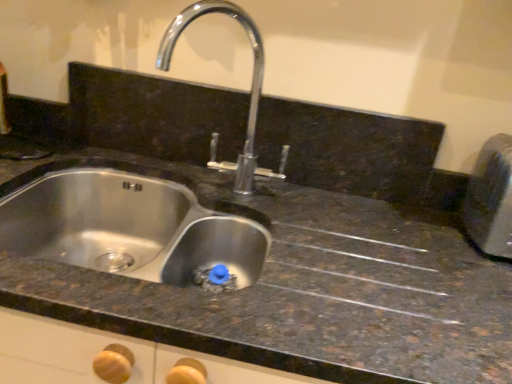
Question: Considering the relative sizes of metallic silver toaster at right and polished chrome tap at center in the image provided, is metallic silver toaster at right taller than polished chrome tap at center?

Choices:
 (A) yes
 (B) no

Answer: (B)

Question: Considering the relative sizes of metallic silver toaster at right and polished chrome tap at center in the image provided, is metallic silver toaster at right thinner than polished chrome tap at center?

Choices:
 (A) no
 (B) yes

Answer: (A)

Question: Does metallic silver toaster at right have a greater width compared to polished chrome tap at center?

Choices:
 (A) yes
 (B) no

Answer: (A)

Question: Is metallic silver toaster at right far from polished chrome tap at center?

Choices:
 (A) yes
 (B) no

Answer: (B)

Question: Is polished chrome tap at center at the back of metallic silver toaster at right?

Choices:
 (A) yes
 (B) no

Answer: (B)

Question: Is the position of metallic silver toaster at right more distant than that of polished chrome tap at center?

Choices:
 (A) yes
 (B) no

Answer: (A)

Question: Is polished chrome tap at center a part of stainless steel sink at center?

Choices:
 (A) no
 (B) yes

Answer: (A)

Question: From a real-world perspective, is stainless steel sink at center physically above polished chrome tap at center?

Choices:
 (A) yes
 (B) no

Answer: (B)

Question: Is stainless steel sink at center wider than polished chrome tap at center?

Choices:
 (A) no
 (B) yes

Answer: (B)

Question: Is stainless steel sink at center shorter than polished chrome tap at center?

Choices:
 (A) no
 (B) yes

Answer: (B)

Question: Is stainless steel sink at center aimed at polished chrome tap at center?

Choices:
 (A) no
 (B) yes

Answer: (A)

Question: Can you confirm if stainless steel sink at center is thinner than polished chrome tap at center?

Choices:
 (A) no
 (B) yes

Answer: (A)

Question: Considering the relative sizes of metallic silver toaster at right and stainless steel sink at center in the image provided, is metallic silver toaster at right taller than stainless steel sink at center?

Choices:
 (A) no
 (B) yes

Answer: (A)